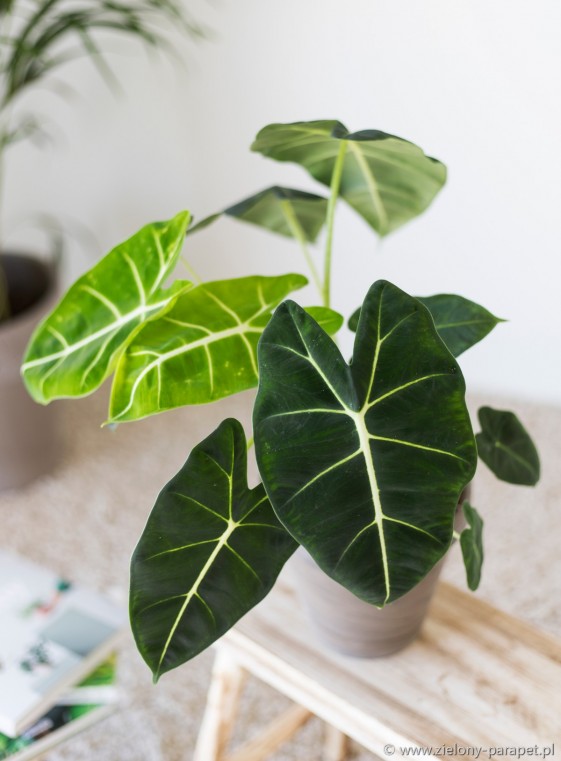
Where is `white wall`? This screenshot has width=561, height=761. white wall is located at coordinates (427, 67).